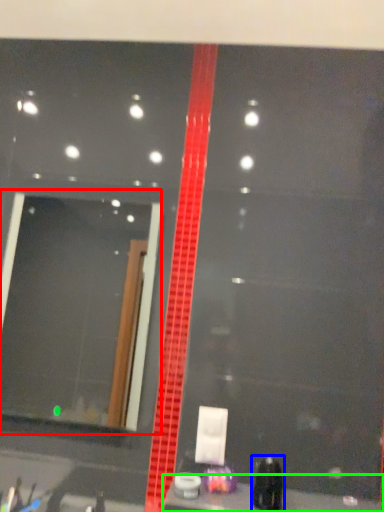
Question: Estimate the real-world distances between objects in this image. Which object is closer to mirror (highlighted by a red box), toiletry (highlighted by a blue box) or counter top (highlighted by a green box)?

Choices:
 (A) toiletry
 (B) counter top

Answer: (B)